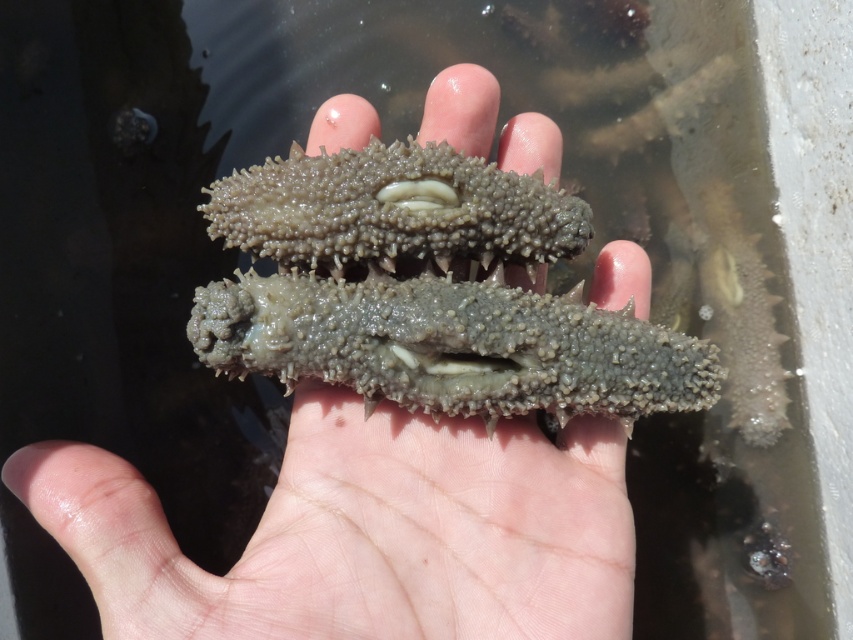
You are a marine biologist examining two sea cucumbers in a tank. You notice the gray matte sea cucumber at center and the gray rough sea cucumber at center. Which one is closer to your eyes?

The gray matte sea cucumber at center is closer to your eyes because it is positioned in front of the gray rough sea cucumber at center.

You are a marine biologist examining two sea cucumbers held in a hand above a shallow water tank. The two sea cucumbers are the gray matte sea cucumber at center and the gray rough sea cucumber at center. Which one has a greater width?

The gray matte sea cucumber at center has a greater width than the gray rough sea cucumber at center.

You are a marine biologist examining two sea cucumbers in a tank. You need to determine which one is taller. Which one is taller between the gray matte sea cucumber at center and the gray rough sea cucumber at center?

The gray matte sea cucumber at center is taller than the gray rough sea cucumber at center according to the description.